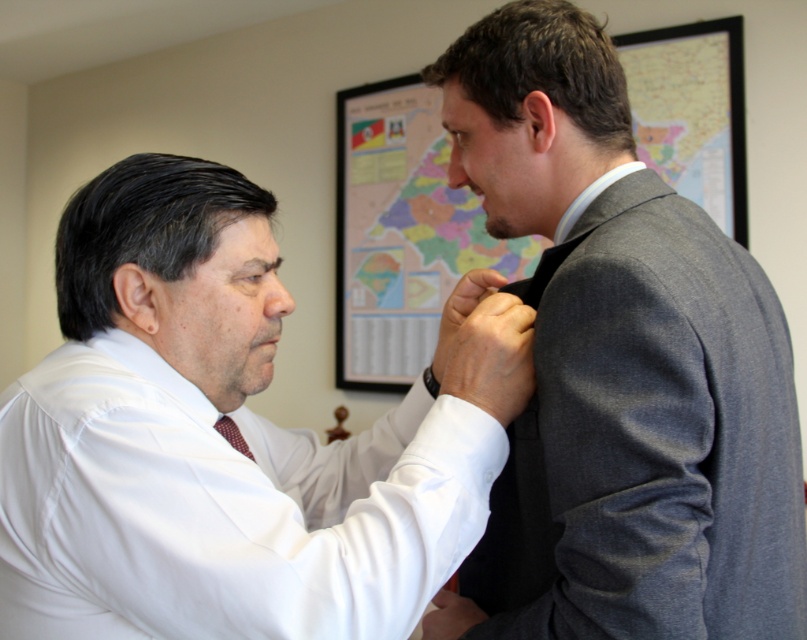
Image resolution: width=807 pixels, height=640 pixels. What do you see at coordinates (224, 440) in the screenshot?
I see `white smooth shirt at center` at bounding box center [224, 440].

Between point (176, 497) and point (233, 440), which one is positioned behind?

The point (233, 440) is more distant.

Find the location of `white smooth shirt at center`. white smooth shirt at center is located at coordinates (224, 440).

Find the location of a particular element. gray wool suit at center is located at coordinates (619, 368).

Is gray wool suit at center above maroon silk tie at center?

Yes.

What do you see at coordinates (619, 368) in the screenshot?
I see `gray wool suit at center` at bounding box center [619, 368].

The width and height of the screenshot is (807, 640). Identify the location of gray wool suit at center. 619,368.

Which is above, white smooth shirt at center or gray wool suit at center?

gray wool suit at center is higher up.

Who is more forward, (212, 316) or (563, 22)?

Point (212, 316)

Where is `white smooth shirt at center`? This screenshot has width=807, height=640. white smooth shirt at center is located at coordinates (224, 440).